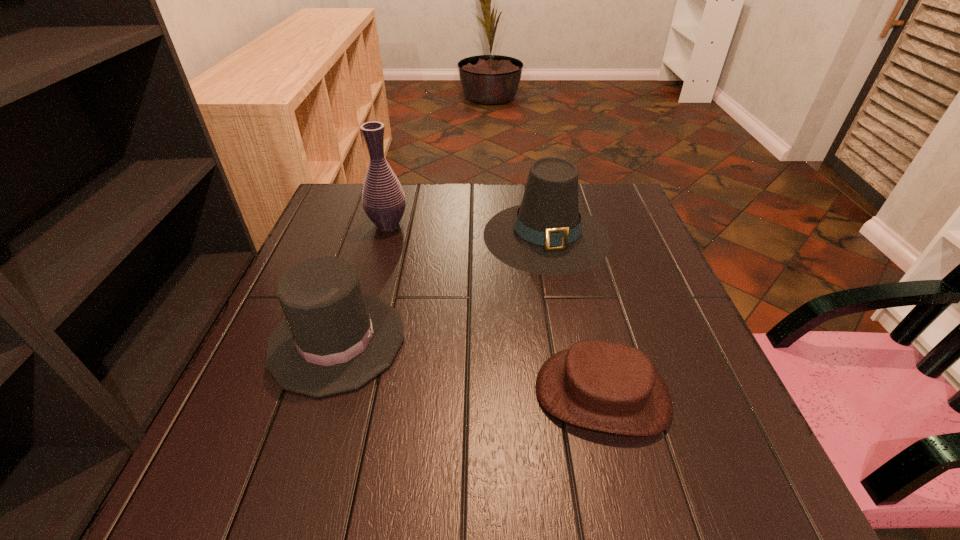
Locate an element on the screen. The height and width of the screenshot is (540, 960). vase is located at coordinates (383, 199).

What are the coordinates of `the farthest hat` in the screenshot? It's located at (547, 234).

Where is `the leftmost hat`? This screenshot has width=960, height=540. the leftmost hat is located at coordinates (334, 339).

This screenshot has height=540, width=960. Identify the location of the second tallest hat. (334, 339).

What are the coordinates of `the shortest object` in the screenshot? It's located at (610, 387).

Locate an element on the screen. free region located 0.080m on the right of the tallest object is located at coordinates (438, 224).

The image size is (960, 540). I want to click on vacant space located 0.340m on the front-facing side of the farthest hat, so click(578, 400).

Where is `vacant region located 0.110m on the front of the leftmost hat with the decoration`? vacant region located 0.110m on the front of the leftmost hat with the decoration is located at coordinates (459, 341).

Locate an element on the screen. vacant area situated on the left of the shortest object is located at coordinates (497, 394).

Where is `vase located at the far edge`? This screenshot has height=540, width=960. vase located at the far edge is located at coordinates click(383, 199).